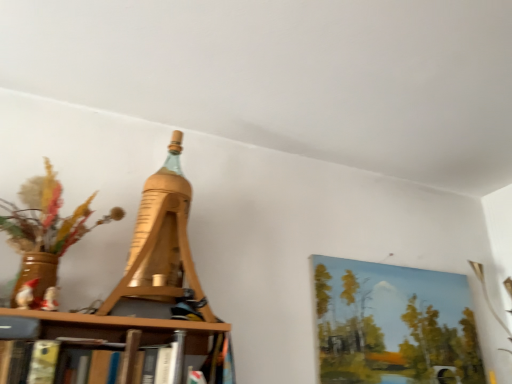
Question: In the image, is wooden eiffel tower at center positioned in front of or behind painted canvas at upper right?

Choices:
 (A) behind
 (B) front

Answer: (B)

Question: From the image's perspective, relative to painted canvas at upper right, is wooden eiffel tower at center above or below?

Choices:
 (A) below
 (B) above

Answer: (B)

Question: Considering the positions of wooden eiffel tower at center and painted canvas at upper right in the image, is wooden eiffel tower at center wider or thinner than painted canvas at upper right?

Choices:
 (A) thin
 (B) wide

Answer: (B)

Question: From a real-world perspective, is painted canvas at upper right above or below wooden eiffel tower at center?

Choices:
 (A) below
 (B) above

Answer: (A)

Question: Is painted canvas at upper right inside or outside of wooden eiffel tower at center?

Choices:
 (A) inside
 (B) outside

Answer: (B)

Question: From the image's perspective, is painted canvas at upper right positioned above or below wooden eiffel tower at center?

Choices:
 (A) below
 (B) above

Answer: (A)

Question: In terms of width, does painted canvas at upper right look wider or thinner when compared to wooden eiffel tower at center?

Choices:
 (A) wide
 (B) thin

Answer: (B)